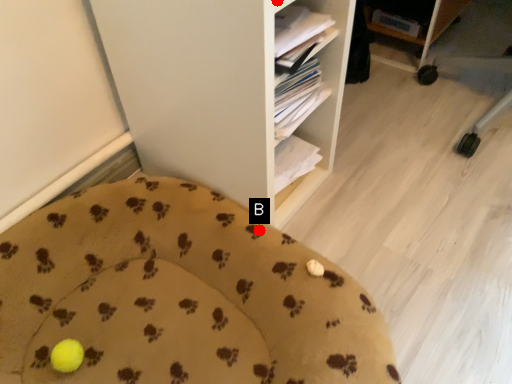
Question: Two points are circled on the image, labeled by A and B beside each circle. Which point is closer to the camera?

Choices:
 (A) A is closer
 (B) B is closer

Answer: (A)